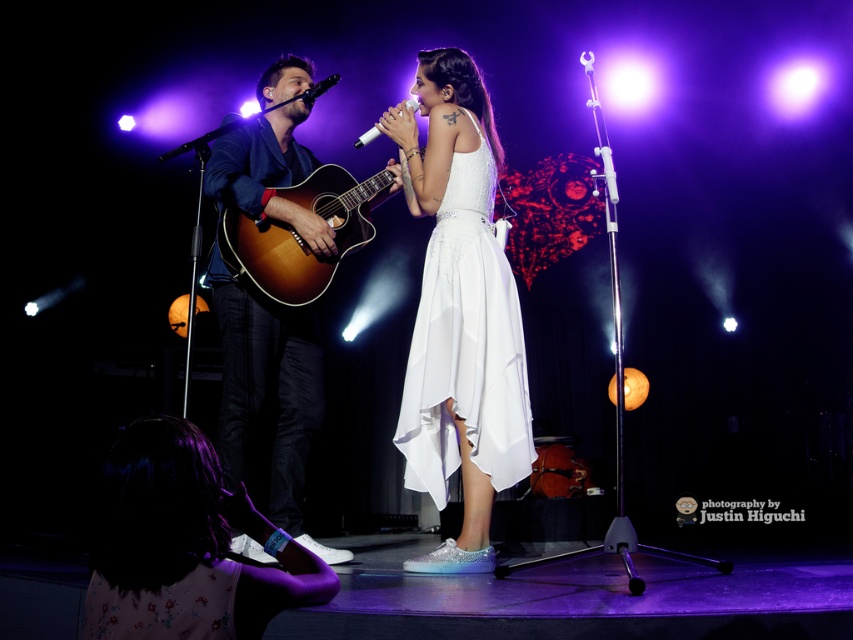
Can you confirm if white satin dress at lower left is positioned above matte brown acoustic guitar at center?

Actually, white satin dress at lower left is below matte brown acoustic guitar at center.

Who is shorter, white satin dress at lower left or matte brown acoustic guitar at center?

With less height is white satin dress at lower left.

Who is more forward, (142,451) or (291,76)?

Positioned in front is point (142,451).

At what (x,y) coordinates should I click in order to perform the action: click on white satin dress at lower left. Please return your answer as a coordinate pair (x, y). Image resolution: width=853 pixels, height=640 pixels. Looking at the image, I should click on (184, 545).

This screenshot has width=853, height=640. Describe the element at coordinates (300, 236) in the screenshot. I see `wooden acoustic guitar at center` at that location.

Is wooden acoustic guitar at center positioned in front of black matte microphone at upper center?

Yes, it is in front of black matte microphone at upper center.

Describe the element at coordinates (300, 236) in the screenshot. This screenshot has height=640, width=853. I see `wooden acoustic guitar at center` at that location.

This screenshot has height=640, width=853. In order to click on wooden acoustic guitar at center in this screenshot , I will do `click(300, 236)`.

Which is in front, point (212, 276) or point (372, 125)?

Point (212, 276) is more forward.

Is point (260, 452) positioned behind point (375, 136)?

Yes, it is.

Where is `matte brown acoustic guitar at center`? The height and width of the screenshot is (640, 853). matte brown acoustic guitar at center is located at coordinates (268, 397).